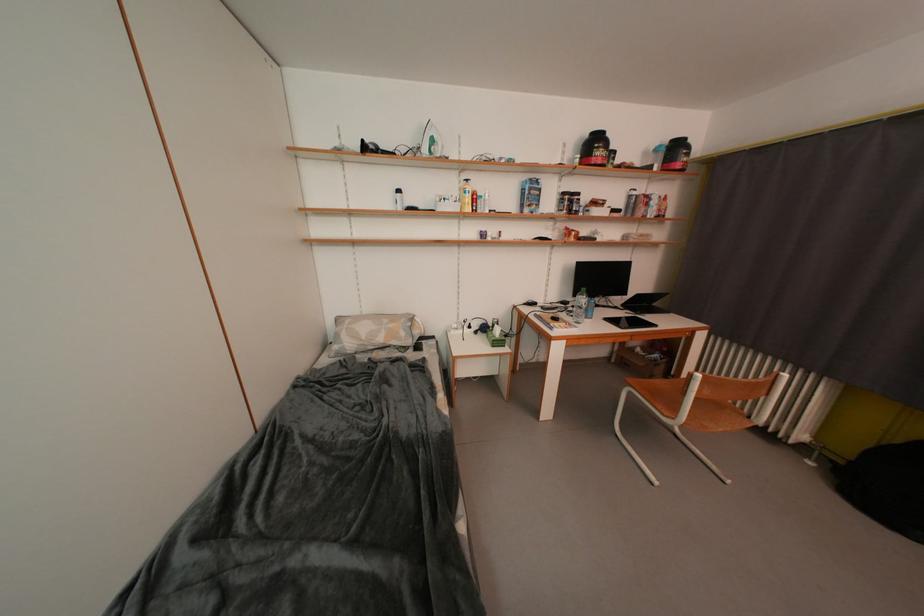
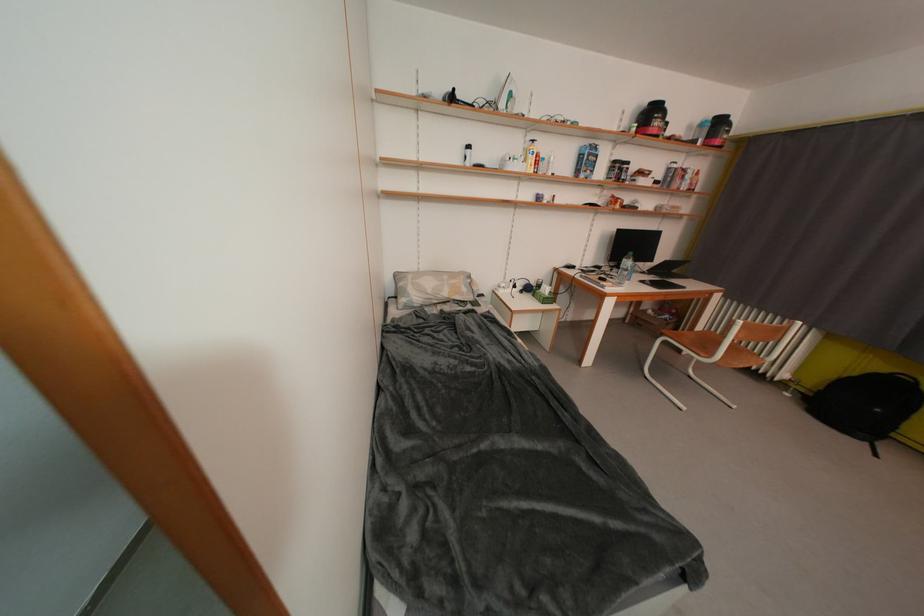
The point at (x=409, y=337) is marked in the first image. Where is the corresponding point in the second image?

(471, 293)